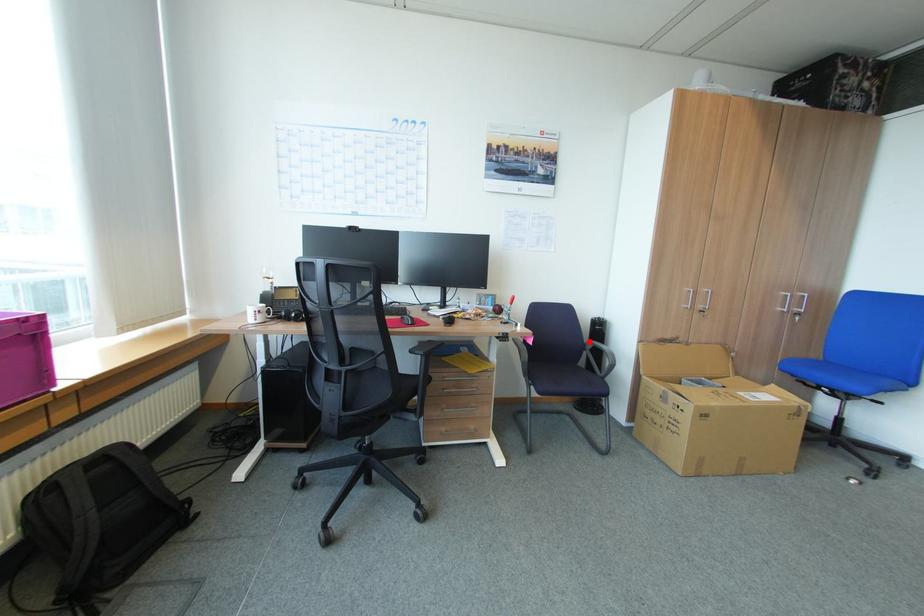
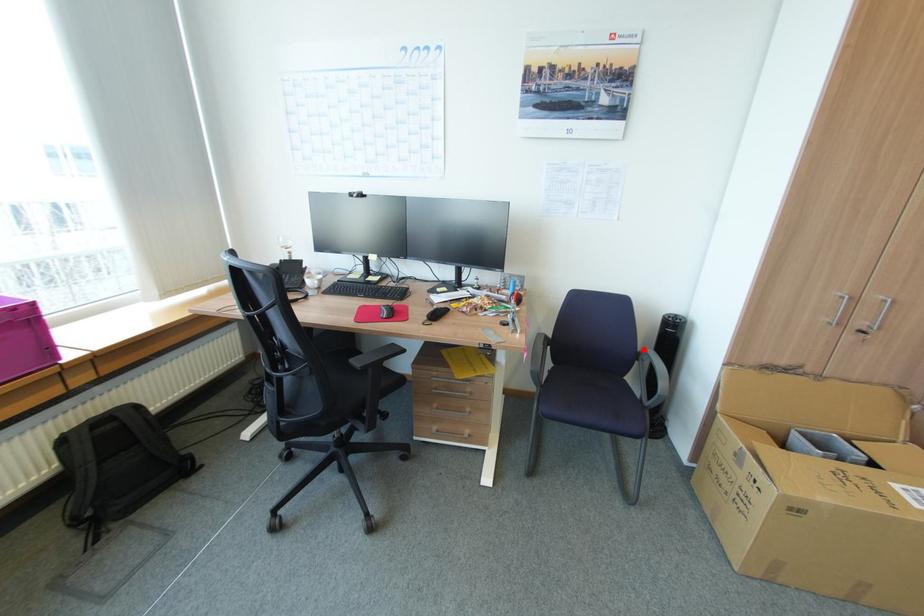
I am providing you with two images of the same scene from different viewpoints. A red point is marked on the first image and another point is marked on the second image. Are the points marked in image1 and image2 representing the same 3D position?

Yes